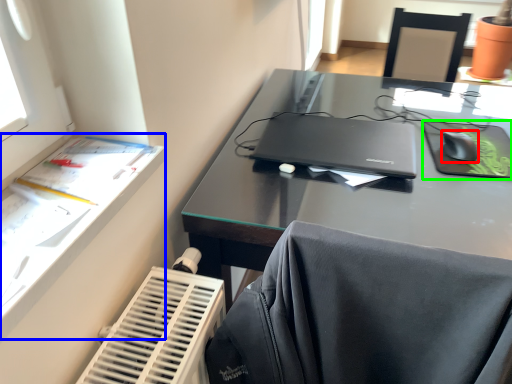
Question: Considering the real-world distances, which object is closest to mouse (highlighted by a red box)? writing desk (highlighted by a blue box) or tablet computer (highlighted by a green box).

Choices:
 (A) writing desk
 (B) tablet computer

Answer: (B)